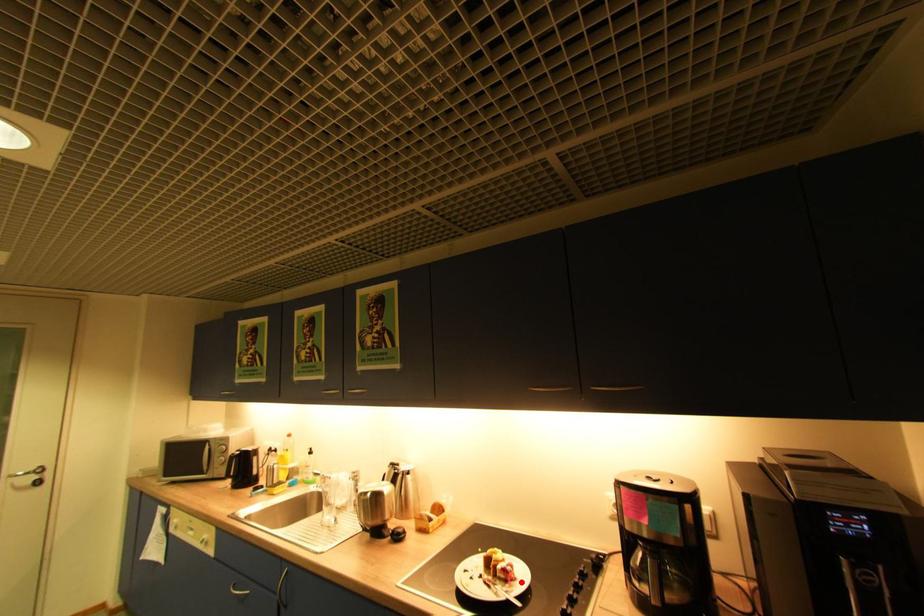
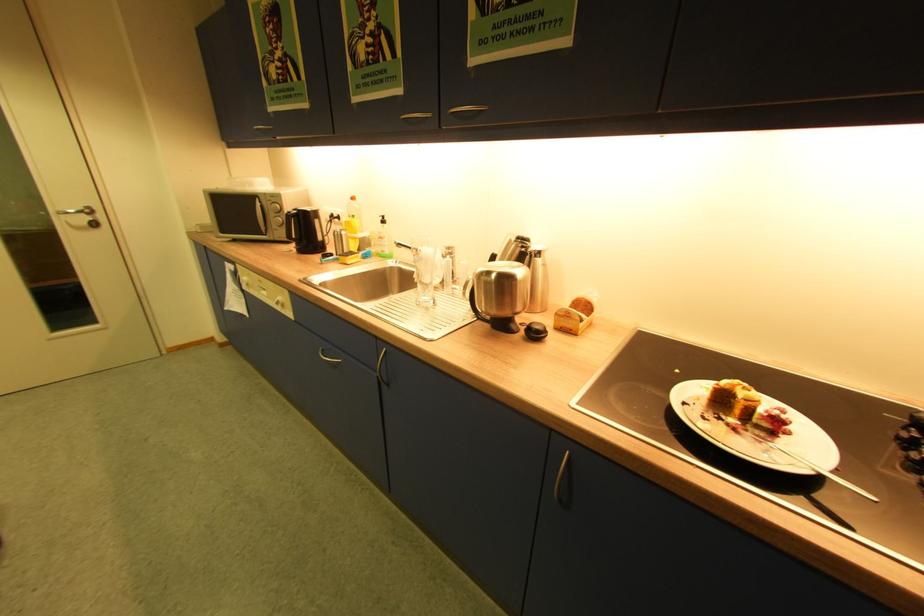
Locate, in the second image, the point that corresponds to the highlighted location in the first image.

(794, 434)